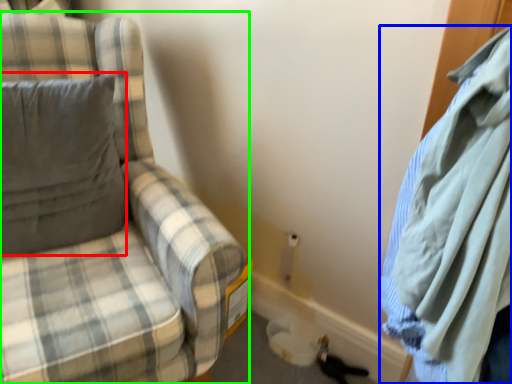
Question: Considering the real-world distances, which object is closest to pillow (highlighted by a red box)? cloak (highlighted by a blue box) or chair (highlighted by a green box).

Choices:
 (A) cloak
 (B) chair

Answer: (B)